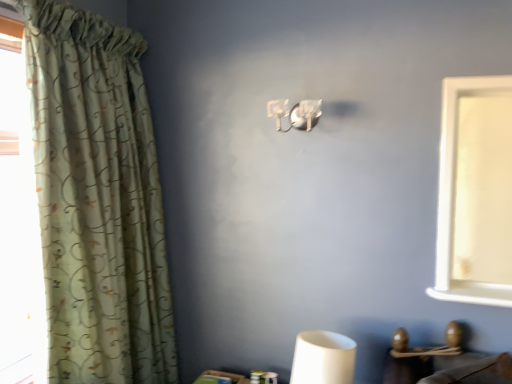
Question: From the image's perspective, relative to green floral fabric curtain at left, is satin silver sconce at upper center above or below?

Choices:
 (A) above
 (B) below

Answer: (A)

Question: In terms of width, does satin silver sconce at upper center look wider or thinner when compared to green floral fabric curtain at left?

Choices:
 (A) wide
 (B) thin

Answer: (B)

Question: Is point (308, 100) positioned closer to the camera than point (70, 94)?

Choices:
 (A) closer
 (B) farther

Answer: (B)

Question: In terms of width, does green floral fabric curtain at left look wider or thinner when compared to satin silver sconce at upper center?

Choices:
 (A) wide
 (B) thin

Answer: (A)

Question: In the image, is green floral fabric curtain at left on the left side or the right side of satin silver sconce at upper center?

Choices:
 (A) left
 (B) right

Answer: (A)

Question: From the image's perspective, is green floral fabric curtain at left above or below satin silver sconce at upper center?

Choices:
 (A) above
 (B) below

Answer: (B)

Question: From a real-world perspective, relative to satin silver sconce at upper center, is green floral fabric curtain at left vertically above or below?

Choices:
 (A) above
 (B) below

Answer: (B)